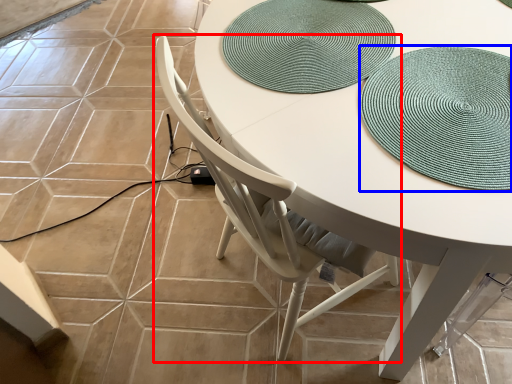
Question: Which object appears farthest to the camera in this image, chair (highlighted by a red box) or hat (highlighted by a blue box)?

Choices:
 (A) chair
 (B) hat

Answer: (B)